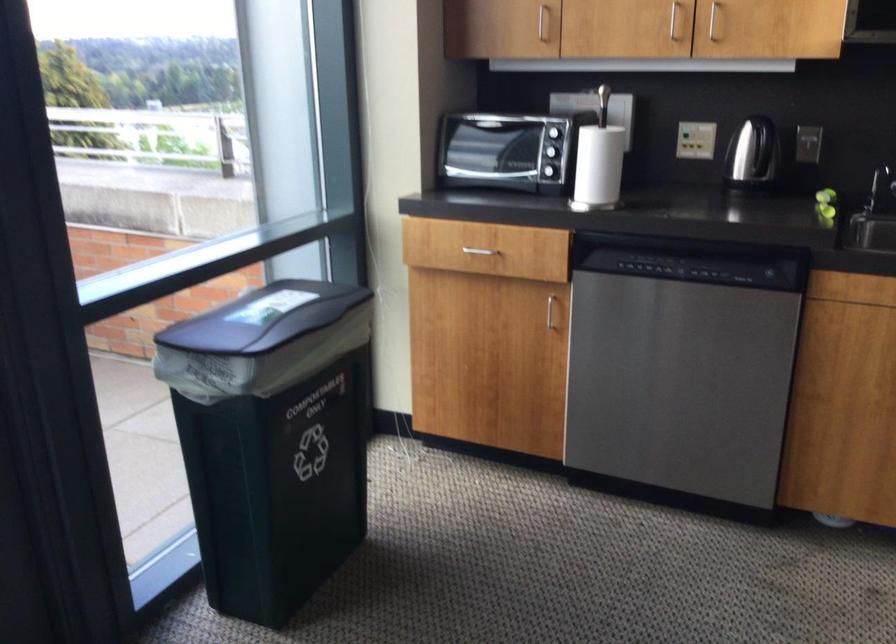
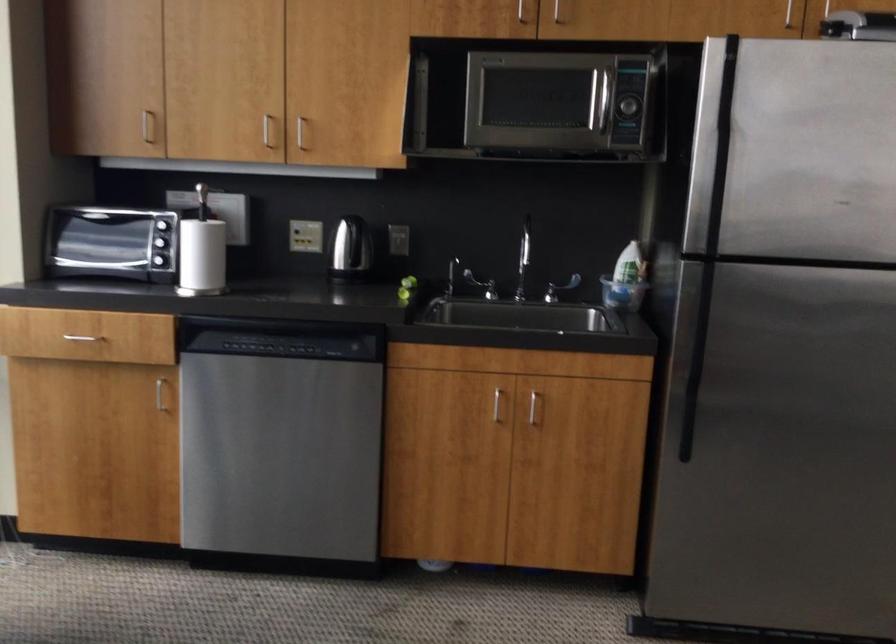
Question: The camera is either moving clockwise (left) or counter-clockwise (right) around the object. The first image is from the beginning of the video and the second image is from the end. Is the camera moving left or right when shooting the video?

Choices:
 (A) Left
 (B) Right

Answer: (A)